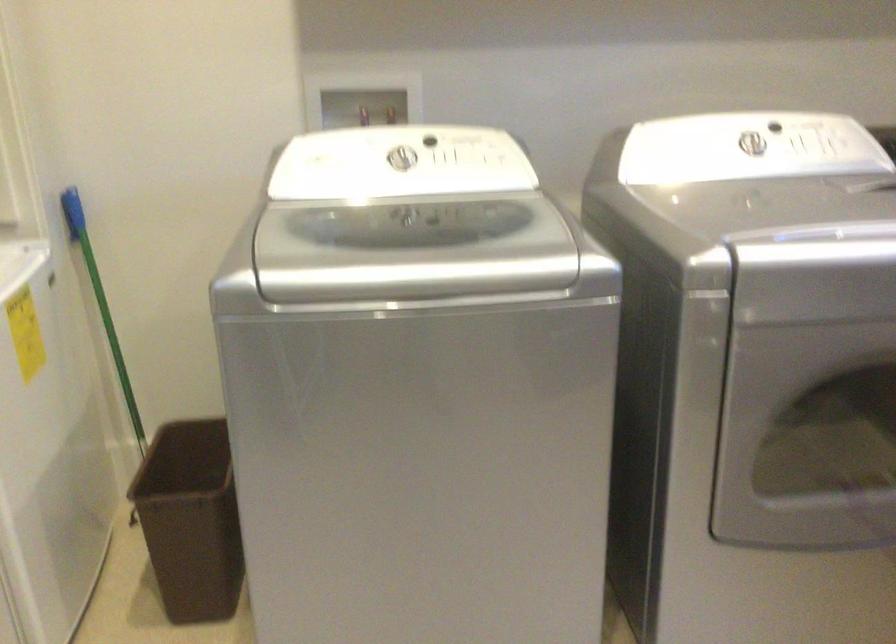
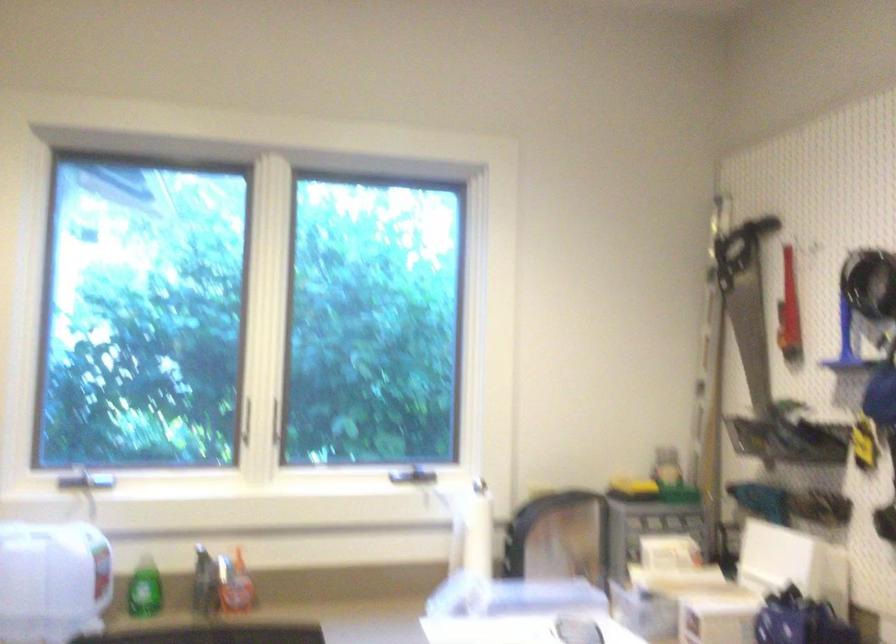
Question: The camera is either moving clockwise (left) or counter-clockwise (right) around the object. The first image is from the beginning of the video and the second image is from the end. Is the camera moving left or right when shooting the video?

Choices:
 (A) Left
 (B) Right

Answer: (A)